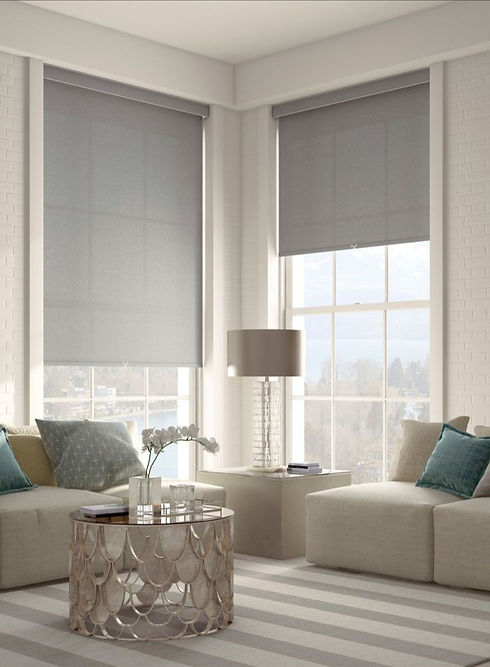
Find the location of a particular element. table is located at coordinates (174, 522).